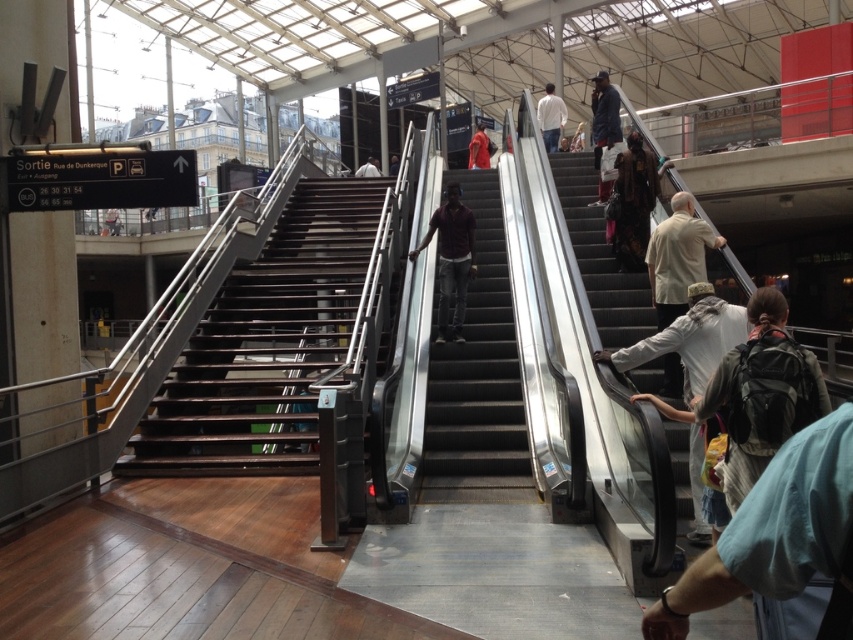
Does metallic gray escalator at center appear over white cotton shirt at right?

Incorrect, metallic gray escalator at center is not positioned above white cotton shirt at right.

Can you confirm if metallic gray escalator at center is taller than white cotton shirt at right?

Incorrect, metallic gray escalator at center's height is not larger of white cotton shirt at right's.

Is point (495, 452) positioned behind point (688, 216)?

Yes, it is behind point (688, 216).

At what (x,y) coordinates should I click in order to perform the action: click on metallic gray escalator at center. Please return your answer as a coordinate pair (x, y). The height and width of the screenshot is (640, 853). Looking at the image, I should click on (479, 376).

Who is taller, matte orange shirt at center or dark brown leather jacket at upper center?

matte orange shirt at center

Is matte orange shirt at center to the left of dark brown leather jacket at upper center from the viewer's perspective?

Yes, matte orange shirt at center is to the left of dark brown leather jacket at upper center.

What do you see at coordinates (479, 148) in the screenshot? I see `matte orange shirt at center` at bounding box center [479, 148].

The width and height of the screenshot is (853, 640). Identify the location of matte orange shirt at center. (479, 148).

Between metallic gray escalator at center and dark brown leather jacket at upper center, which one has more height?

dark brown leather jacket at upper center is taller.

Does metallic gray escalator at center come in front of dark brown leather jacket at upper center?

That is True.

Which is in front, point (496, 291) or point (575, 134)?

Point (496, 291)

Where is `metallic gray escalator at center`? The image size is (853, 640). metallic gray escalator at center is located at coordinates (479, 376).